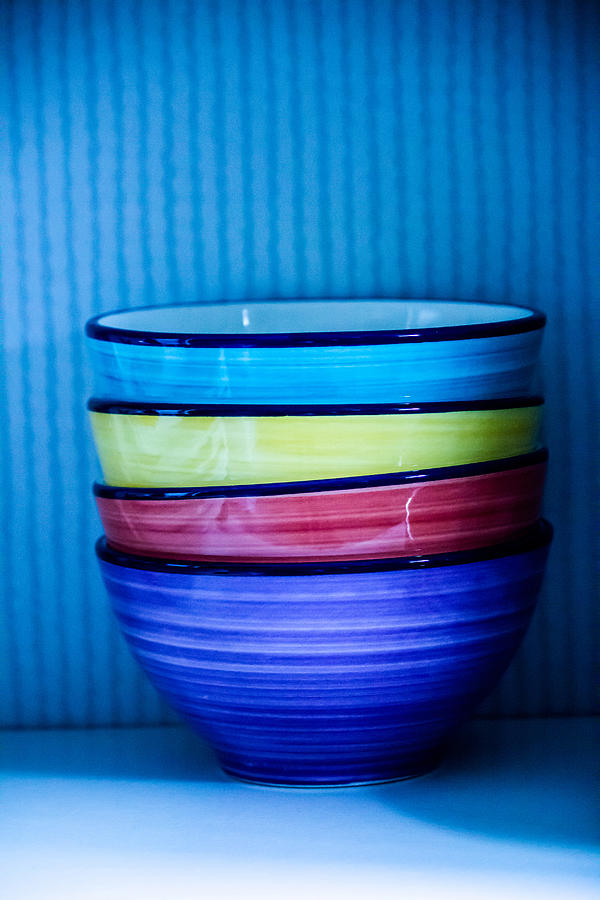
In order to click on bottom of bowl in this screenshot , I will do `click(329, 787)`.